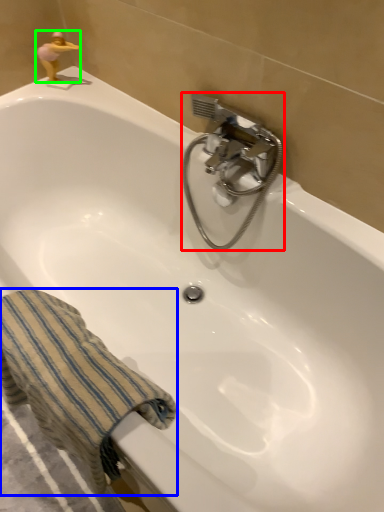
Question: Which object is positioned farthest from plumbing fixture (highlighted by a red box)? Select from towel/napkin (highlighted by a blue box) and miniature (highlighted by a green box).

Choices:
 (A) towel/napkin
 (B) miniature

Answer: (B)